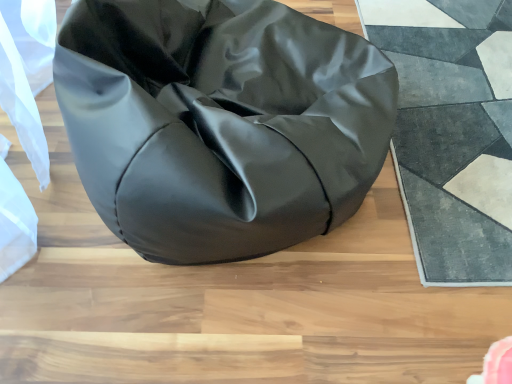
In order to click on free point below textured gray rug at right (from a real-world perspective) in this screenshot , I will do `click(450, 100)`.